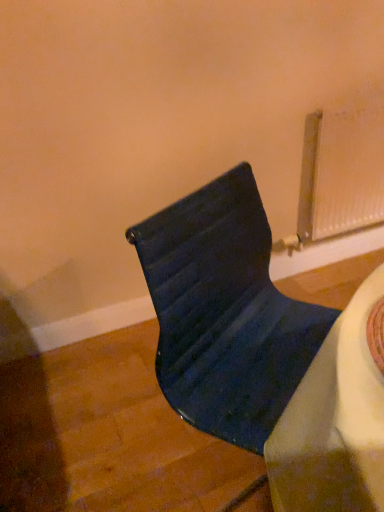
In order to face glossy dark blue chair at center, should I rotate leftwards or rightwards?

Turn right by 7.735 degrees to look at glossy dark blue chair at center.

The image size is (384, 512). Find the location of `glossy dark blue chair at center`. glossy dark blue chair at center is located at coordinates (225, 312).

Describe the element at coordinates (225, 312) in the screenshot. I see `glossy dark blue chair at center` at that location.

Locate an element on the screen. glossy dark blue chair at center is located at coordinates (225, 312).